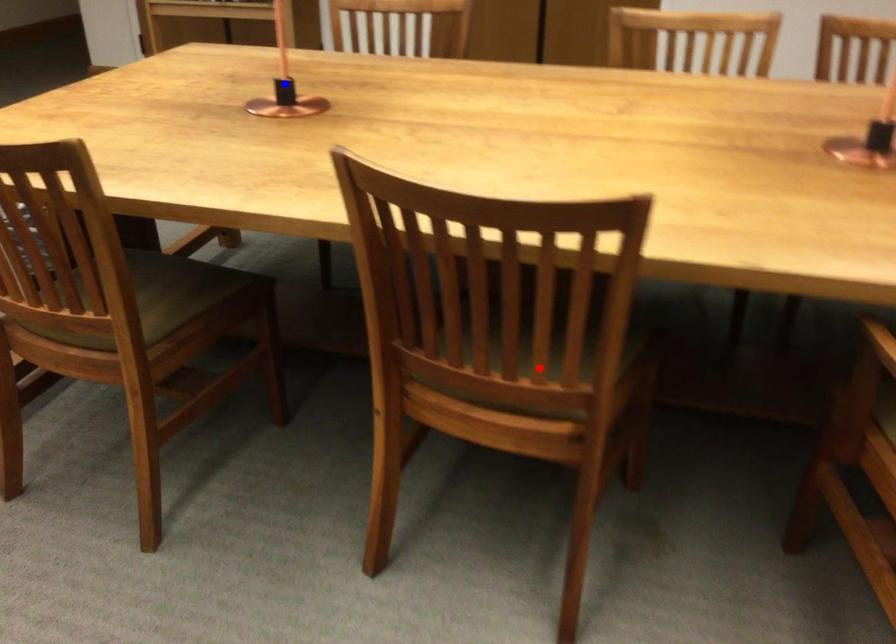
Question: In the image, two points are highlighted. Which point is nearer to the camera? Reply with the corresponding letter.

Choices:
 (A) blue point
 (B) red point

Answer: (B)